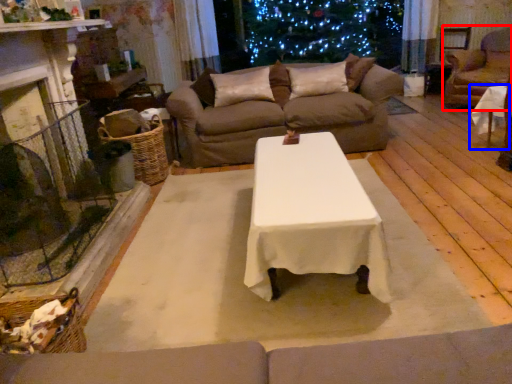
Question: Among these objects, which one is nearest to the camera, armchair (highlighted by a red box) or table (highlighted by a blue box)?

Choices:
 (A) armchair
 (B) table

Answer: (B)